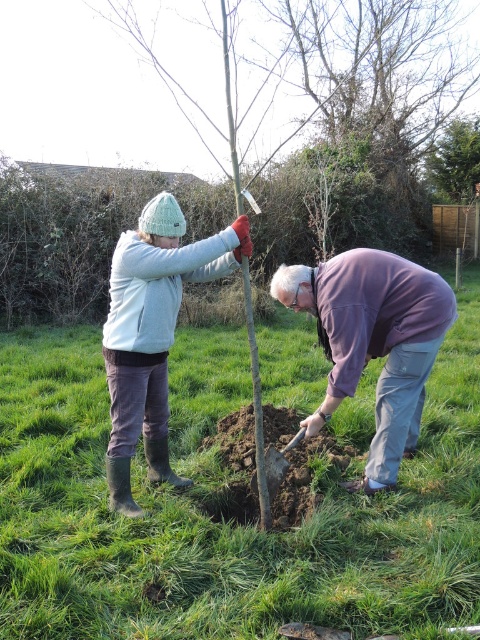
Question: Is green grass at center closer to the viewer compared to matte gray sweater at center?

Choices:
 (A) no
 (B) yes

Answer: (B)

Question: Which is nearer to the green leafy tree at upper center?

Choices:
 (A) light gray fleece jacket at center
 (B) matte gray sweater at center

Answer: (B)

Question: Is green grass at center above green leafy tree at upper center?

Choices:
 (A) no
 (B) yes

Answer: (A)

Question: Which point appears farthest from the camera in this image?

Choices:
 (A) (397, 273)
 (B) (445, 198)
 (C) (323, 515)

Answer: (B)

Question: Does green grass at center appear on the left side of purple cotton shirt at lower center?

Choices:
 (A) yes
 (B) no

Answer: (A)

Question: Which object is the farthest from the green leafy tree at upper center?

Choices:
 (A) green grass at center
 (B) purple cotton shirt at lower center

Answer: (A)